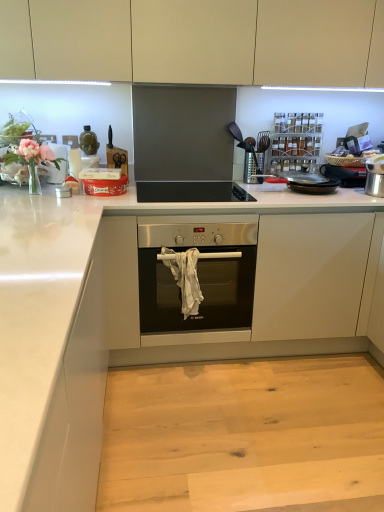
At what (x,y) coordinates should I click in order to perform the action: click on black matte gas stove at upper center. Please return your answer as a coordinate pair (x, y). The image size is (384, 512). Looking at the image, I should click on (191, 192).

Image resolution: width=384 pixels, height=512 pixels. Describe the element at coordinates (138, 315) in the screenshot. I see `white glossy countertop at center` at that location.

I want to click on metallic spice rack at upper right, so click(x=296, y=140).

Where is `black matte gas stove at upper center`? black matte gas stove at upper center is located at coordinates [x=191, y=192].

From the picture: From the image's perspective, is black matte gas stove at upper center under white glossy countertop at center?

Actually, black matte gas stove at upper center appears above white glossy countertop at center in the image.

The image size is (384, 512). What are the coordinates of `gas stove behind the white glossy countertop at center` in the screenshot? It's located at (191, 192).

Considering the sizes of objects black matte gas stove at upper center and white glossy countertop at center in the image provided, who is bigger, black matte gas stove at upper center or white glossy countertop at center?

white glossy countertop at center is bigger.

Is point (224, 191) less distant than point (8, 403)?

No, (224, 191) is further to viewer.

The image size is (384, 512). Identify the location of gas stove below the matte beige cabinets at upper center (from the image's perspective). (191, 192).

Does black matte gas stove at upper center have a lesser width compared to matte beige cabinets at upper center?

A: Yes.

From a real-world perspective, is black matte gas stove at upper center over matte beige cabinets at upper center?

No, from a real-world perspective, black matte gas stove at upper center is not over matte beige cabinets at upper center

From the image's perspective, which is below, black matte gas stove at upper center or matte beige cabinets at upper center?

black matte gas stove at upper center.

Which is in front, point (149, 199) or point (291, 130)?

The point (149, 199) is closer to the camera.

Is black matte gas stove at upper center positioned far away from metallic spice rack at upper right?

black matte gas stove at upper center is near metallic spice rack at upper right, not far away.

Considering the sizes of objects black matte gas stove at upper center and metallic spice rack at upper right in the image provided, who is bigger, black matte gas stove at upper center or metallic spice rack at upper right?

black matte gas stove at upper center.

At what (x,y) coordinates should I click in order to perform the action: click on gas stove located below the metallic spice rack at upper right (from the image's perspective). Please return your answer as a coordinate pair (x, y). Looking at the image, I should click on (191, 192).

Can you confirm if metallic spice rack at upper right is positioned to the left of black matte gas stove at upper center?

Incorrect, metallic spice rack at upper right is not on the left side of black matte gas stove at upper center.

Considering the points (279, 119) and (195, 201), which point is in front, point (279, 119) or point (195, 201)?

The point (195, 201) is closer.

Considering the sizes of metallic spice rack at upper right and black matte gas stove at upper center in the image, is metallic spice rack at upper right wider or thinner than black matte gas stove at upper center?

Clearly, metallic spice rack at upper right has less width compared to black matte gas stove at upper center.

Locate an element on the screen. The image size is (384, 512). appliance above the black matte gas stove at upper center (from the image's perspective) is located at coordinates (296, 140).

Is white glossy countertop at center outside of matte beige cabinets at upper center?

Yes, white glossy countertop at center is outside of matte beige cabinets at upper center.

Is matte beige cabinets at upper center at the back of white glossy countertop at center?

That's not correct — white glossy countertop at center is not looking away from matte beige cabinets at upper center.

Which object is positioned more to the right, white glossy countertop at center or matte beige cabinets at upper center?

From the viewer's perspective, white glossy countertop at center appears more on the right side.

Is white glossy countertop at center to the left or to the right of black matte gas stove at upper center in the image?

white glossy countertop at center is to the right of black matte gas stove at upper center.

Is white glossy countertop at center wider or thinner than black matte gas stove at upper center?

In the image, white glossy countertop at center appears to be wider than black matte gas stove at upper center.

Identify the location of gas stove located behind the white glossy countertop at center. (191, 192).

Considering the positions of point (313, 119) and point (83, 228), is point (313, 119) closer or farther from the camera than point (83, 228)?

Clearly, point (313, 119) is more distant from the camera than point (83, 228).

Considering the relative sizes of metallic spice rack at upper right and white glossy countertop at center in the image provided, is metallic spice rack at upper right thinner than white glossy countertop at center?

Indeed, metallic spice rack at upper right has a lesser width compared to white glossy countertop at center.

Looking at this image, from a real-world perspective, which object rests below the other?

In real-world perspective, white glossy countertop at center is lower.

Is metallic spice rack at upper right touching white glossy countertop at center?

No, metallic spice rack at upper right is not in contact with white glossy countertop at center.

The image size is (384, 512). I want to click on countertop below the black matte gas stove at upper center (from a real-world perspective), so click(x=138, y=315).

Locate an element on the screen. gas stove that appears on the left of matte beige cabinets at upper center is located at coordinates (191, 192).

Estimate the real-world distances between objects in this image. Which object is closer to matte beige cabinets at upper center, metallic spice rack at upper right or black matte gas stove at upper center?

The object closer to matte beige cabinets at upper center is metallic spice rack at upper right.

Considering their positions, is white glossy countertop at center positioned further to metallic spice rack at upper right than black matte gas stove at upper center?

white glossy countertop at center is further to metallic spice rack at upper right.

Estimate the real-world distances between objects in this image. Which object is further from white glossy countertop at center, metallic spice rack at upper right or matte beige cabinets at upper center?

matte beige cabinets at upper center.

Based on their spatial positions, is metallic spice rack at upper right or white glossy countertop at center further from black matte gas stove at upper center?

Based on the image, metallic spice rack at upper right appears to be further to black matte gas stove at upper center.

Consider the image. When comparing their distances from black matte gas stove at upper center, does white glossy countertop at center or metallic spice rack at upper right seem further?

metallic spice rack at upper right.

Estimate the real-world distances between objects in this image. Which object is further from matte beige cabinets at upper center, black matte gas stove at upper center or metallic spice rack at upper right?

The object further to matte beige cabinets at upper center is black matte gas stove at upper center.

From the picture: Looking at the image, which one is located closer to matte beige cabinets at upper center, white glossy countertop at center or metallic spice rack at upper right?

The object closer to matte beige cabinets at upper center is metallic spice rack at upper right.

Considering their positions, is black matte gas stove at upper center positioned further to matte beige cabinets at upper center than white glossy countertop at center?

white glossy countertop at center lies further to matte beige cabinets at upper center than the other object.

Where is `countertop located between matte beige cabinets at upper center and metallic spice rack at upper right in the depth direction`? The height and width of the screenshot is (512, 384). countertop located between matte beige cabinets at upper center and metallic spice rack at upper right in the depth direction is located at coordinates (138, 315).

This screenshot has height=512, width=384. I want to click on gas stove between white glossy countertop at center and metallic spice rack at upper right along the z-axis, so click(x=191, y=192).

What are the coordinates of `gas stove between matte beige cabinets at upper center and metallic spice rack at upper right along the z-axis` in the screenshot? It's located at (191, 192).

Locate an element on the screen. countertop positioned between matte beige cabinets at upper center and black matte gas stove at upper center from near to far is located at coordinates (138, 315).